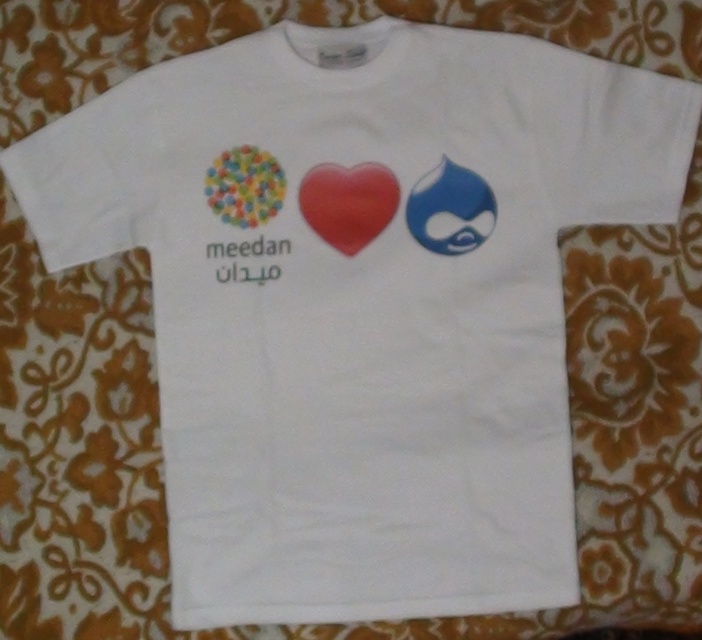
You are designing a new T shirt and want to place a logo between the matte red heart at center and the blue glossy whale at upper right. Where should you place the logo?

The logo should be placed between the matte red heart at center and the blue glossy whale at upper right, to the right of the matte red heart at center and to the left of the blue glossy whale at upper right since the matte red heart at center is to the left of the blue glossy whale at upper right.

You are standing 5 feet away from the white T shirt displayed on the surface. If you want to see the matte red heart at center clearly, do you need to move closer or farther away?

A: The matte red heart at center is 3.65 feet away from the camera. Since you are currently standing 5 feet away, you need to move closer to it to see it clearly.

From the picture: You are designing a layout for a new T shirt and want to place a blue glossy whale at upper right and multicolored glossy beads at upper left. Based on the existing T shirt design, which object would appear larger in the final design?

The blue glossy whale at upper right would appear larger because it is closer to the viewer than the multicolored glossy beads at upper left.